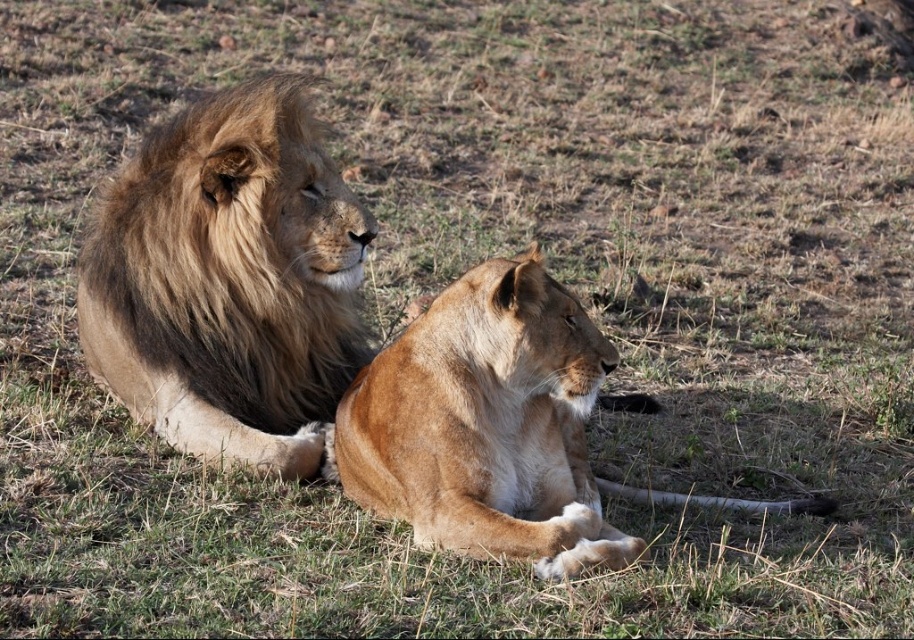
Does golden fur lion at upper left have a lesser width compared to golden fur lion at center?

No, golden fur lion at upper left is not thinner than golden fur lion at center.

Does point (230, 221) come closer to viewer compared to point (415, 532)?

That is False.

Is point (254, 188) positioned after point (490, 280)?

Yes.

Where is `golden fur lion at upper left`? golden fur lion at upper left is located at coordinates (228, 282).